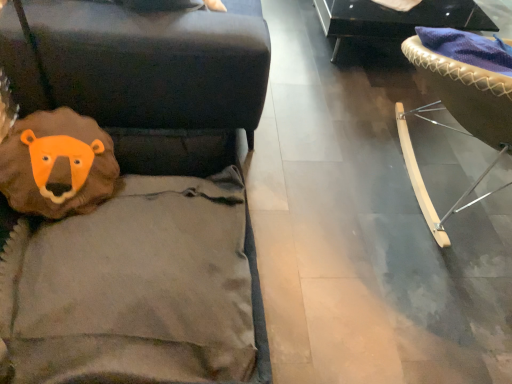
Question: Is point (506, 150) closer or farther from the camera than point (416, 18)?

Choices:
 (A) farther
 (B) closer

Answer: (B)

Question: Is light brown leather chair at right, the 2th furniture from the top, wider or thinner than shiny black coffee table at upper right, which ranks as the second furniture in front-to-back order?

Choices:
 (A) thin
 (B) wide

Answer: (B)

Question: From their relative heights in the image, would you say light brown leather chair at right, acting as the 2th furniture starting from the back, is taller or shorter than shiny black coffee table at upper right, which is counted as the first furniture, starting from the top?

Choices:
 (A) short
 (B) tall

Answer: (B)

Question: Is shiny black coffee table at upper right, which ranks as the second furniture in front-to-back order, to the left or to the right of light brown leather chair at right, positioned as the first furniture in front-to-back order, in the image?

Choices:
 (A) left
 (B) right

Answer: (A)

Question: Is shiny black coffee table at upper right, which is counted as the first furniture, starting from the top, wider or thinner than light brown leather chair at right, acting as the 2th furniture starting from the back?

Choices:
 (A) wide
 (B) thin

Answer: (B)

Question: From a real-world perspective, relative to light brown leather chair at right, acting as the 2th furniture starting from the back, is shiny black coffee table at upper right, which ranks as the 1th furniture in back-to-front order, vertically above or below?

Choices:
 (A) below
 (B) above

Answer: (A)

Question: Is point (364, 16) closer or farther from the camera than point (505, 140)?

Choices:
 (A) farther
 (B) closer

Answer: (A)